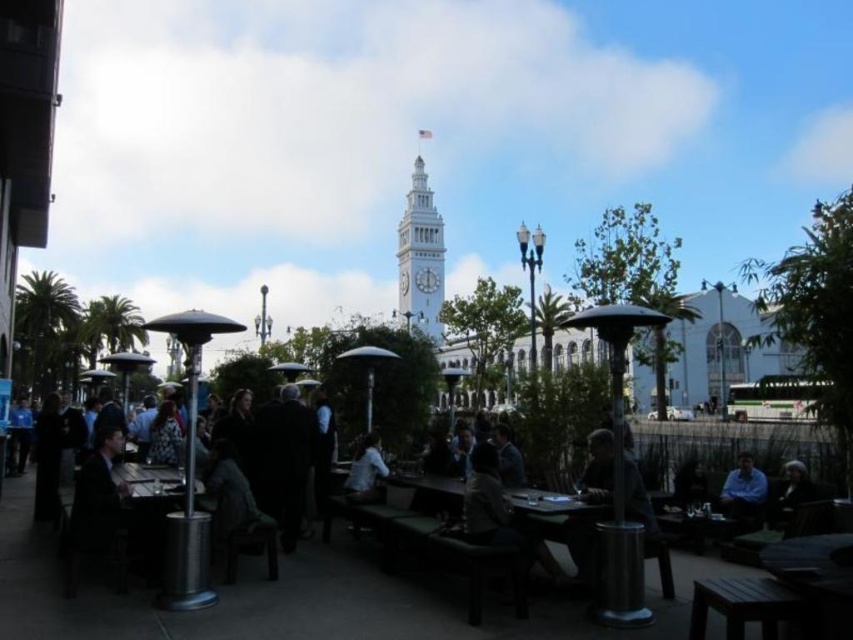
Is dark brown wood picnic table at lower right below dark brown leather jacket at lower right?

Yes.

The height and width of the screenshot is (640, 853). What do you see at coordinates (744, 605) in the screenshot?
I see `dark brown wood picnic table at lower right` at bounding box center [744, 605].

Is point (776, 612) positioned in front of point (785, 513)?

Yes, point (776, 612) is closer to viewer.

In order to click on dark brown wood picnic table at lower right in this screenshot , I will do `click(744, 605)`.

Can you confirm if white painted metal clock tower at center is smaller than dark brown leather jacket at lower right?

Incorrect, white painted metal clock tower at center is not smaller in size than dark brown leather jacket at lower right.

Between point (416, 166) and point (775, 502), which one is positioned in front?

Point (775, 502) is in front.

Between point (430, 284) and point (779, 496), which one is positioned behind?

The point (430, 284) is more distant.

What are the coordinates of `white painted metal clock tower at center` in the screenshot? It's located at click(421, 257).

Is point (734, 476) closer to viewer compared to point (815, 490)?

No.

Can you confirm if blue shirt at lower right is positioned to the right of dark brown leather jacket at lower right?

No, blue shirt at lower right is not to the right of dark brown leather jacket at lower right.

Image resolution: width=853 pixels, height=640 pixels. What are the coordinates of `blue shirt at lower right` in the screenshot? It's located at (743, 490).